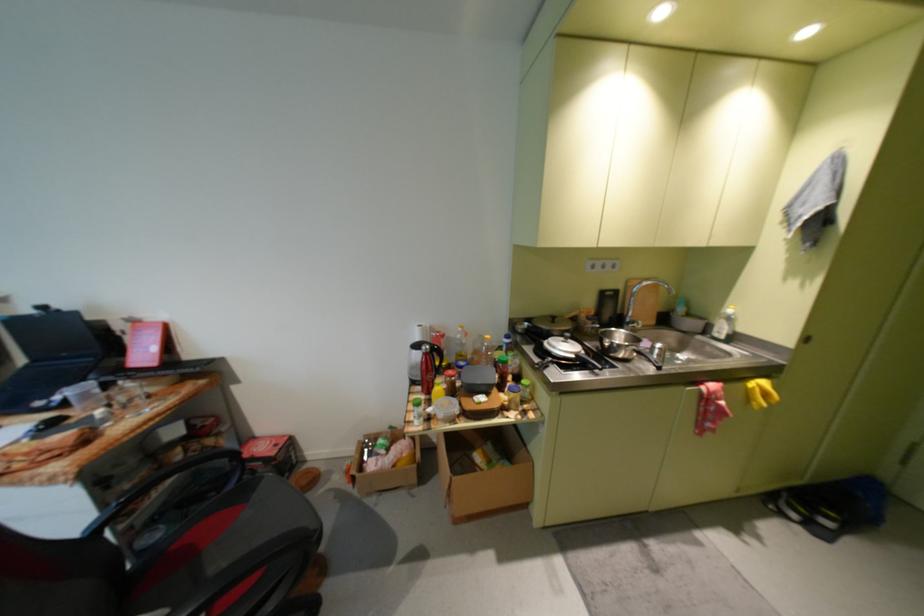
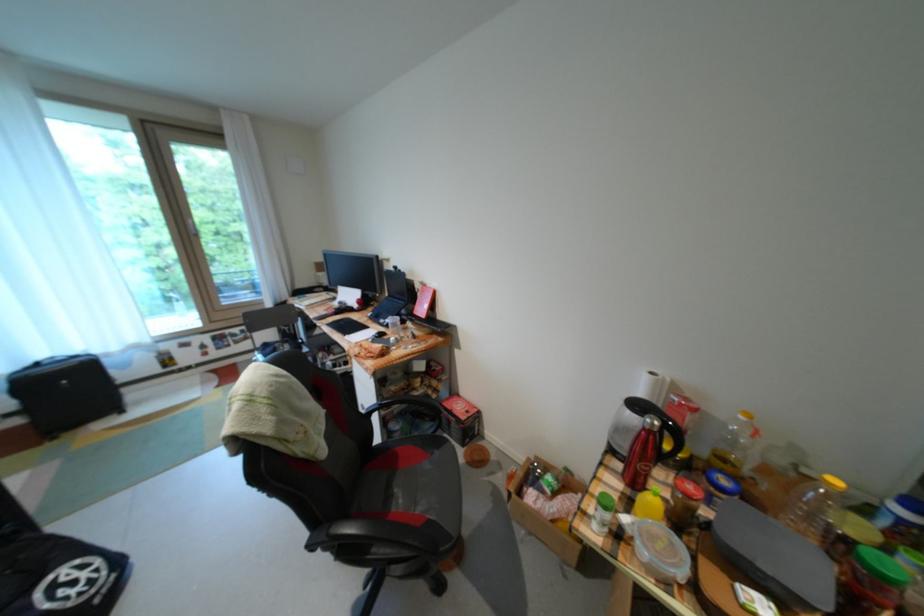
Locate, in the second image, the point that corresponds to (439,358) in the first image.

(662, 438)